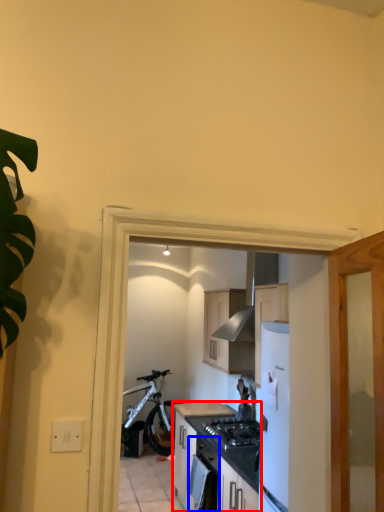
Question: Among these objects, which one is nearest to the camera, cabinetry (highlighted by a red box) or oven (highlighted by a blue box)?

Choices:
 (A) cabinetry
 (B) oven

Answer: (B)